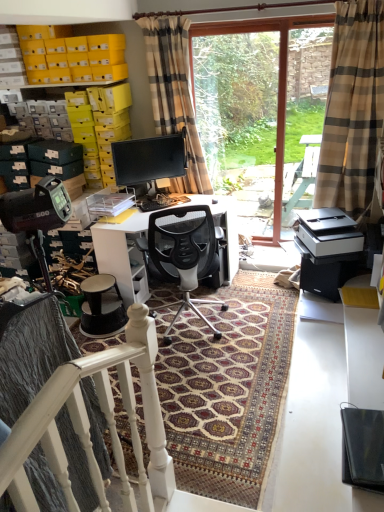
Question: Should I look upward or downward to see white glossy desk at center?

Choices:
 (A) down
 (B) up

Answer: (B)

Question: Is beige plaid curtain at right, the 1th curtain from the right, far away from black mesh office chair at center?

Choices:
 (A) yes
 (B) no

Answer: (A)

Question: From the image's perspective, is beige plaid curtain at right, the 1th curtain from the right, beneath black mesh office chair at center?

Choices:
 (A) no
 (B) yes

Answer: (A)

Question: Does beige plaid curtain at right, the 1th curtain from the right, turn towards black mesh office chair at center?

Choices:
 (A) yes
 (B) no

Answer: (B)

Question: Does beige plaid curtain at right, which appears as the second curtain when viewed from the left, come in front of black mesh office chair at center?

Choices:
 (A) no
 (B) yes

Answer: (B)

Question: Is beige plaid curtain at right, which appears as the second curtain when viewed from the left, wider than black mesh office chair at center?

Choices:
 (A) no
 (B) yes

Answer: (A)

Question: Does beige plaid curtain at right, which appears as the second curtain when viewed from the left, contain black mesh office chair at center?

Choices:
 (A) yes
 (B) no

Answer: (B)

Question: From a real-world perspective, does black mesh office chair at center stand above black plastic printer at lower right?

Choices:
 (A) no
 (B) yes

Answer: (A)

Question: Does black mesh office chair at center have a greater height compared to black plastic printer at lower right?

Choices:
 (A) no
 (B) yes

Answer: (B)

Question: From the image's perspective, is black mesh office chair at center above black plastic printer at lower right?

Choices:
 (A) no
 (B) yes

Answer: (A)

Question: Does black mesh office chair at center have a larger size compared to black plastic printer at lower right?

Choices:
 (A) no
 (B) yes

Answer: (B)

Question: Is black mesh office chair at center facing away from black plastic printer at lower right?

Choices:
 (A) no
 (B) yes

Answer: (A)

Question: Is black plastic printer at lower right inside black mesh office chair at center?

Choices:
 (A) yes
 (B) no

Answer: (B)

Question: Is transparent glass door at center shorter than matte black monitor at center?

Choices:
 (A) yes
 (B) no

Answer: (B)